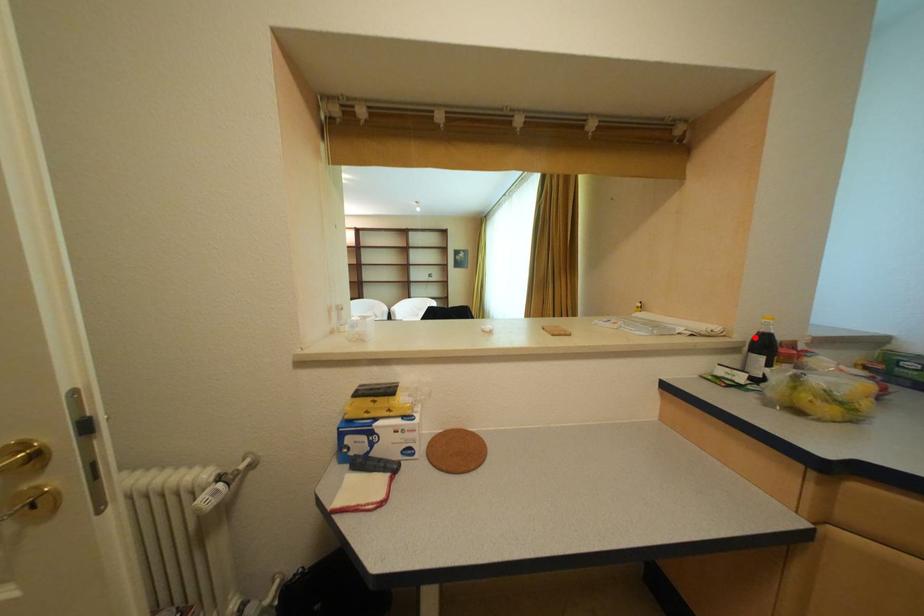
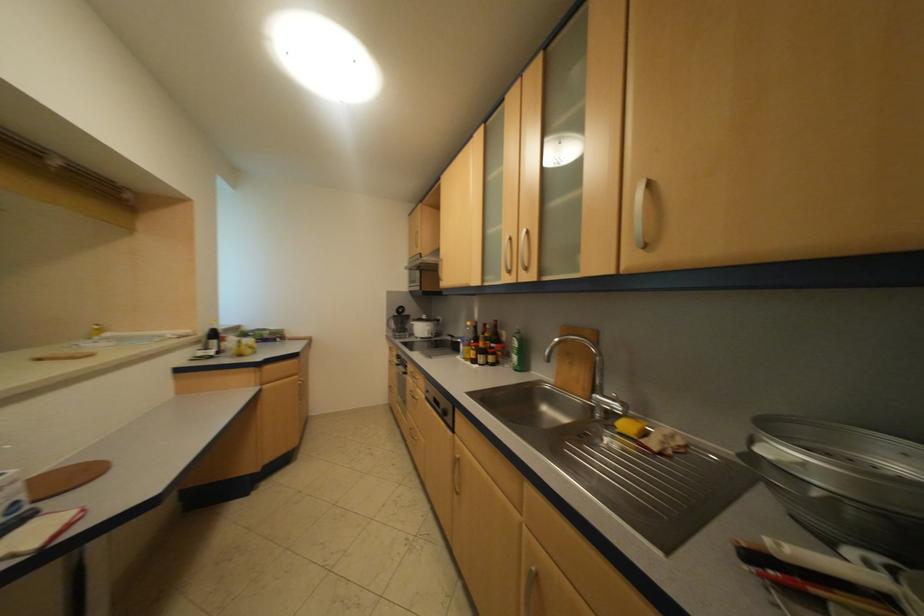
Locate, in the second image, the point that corresponds to the highlighted location in the first image.

(214, 334)